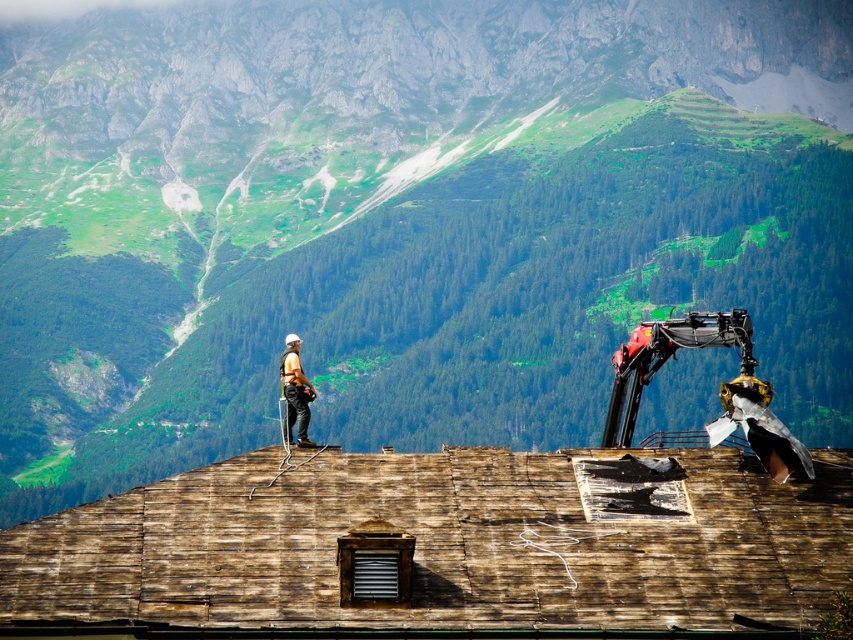
Question: Does weathered wood roof at center have a lesser width compared to white hard hat at center?

Choices:
 (A) no
 (B) yes

Answer: (A)

Question: Can you confirm if weathered wood roof at center is positioned above metallic red robotic arm at upper right?

Choices:
 (A) no
 (B) yes

Answer: (A)

Question: Which point is closer to the camera?

Choices:
 (A) weathered wood roof at center
 (B) metallic red robotic arm at upper right

Answer: (A)

Question: Which of the following is the closest to the observer?

Choices:
 (A) white hard hat at center
 (B) metallic red robotic arm at upper right
 (C) weathered wood roof at center

Answer: (C)

Question: Estimate the real-world distances between objects in this image. Which object is farther from the white hard hat at center?

Choices:
 (A) metallic red robotic arm at upper right
 (B) weathered wood roof at center

Answer: (A)

Question: Is weathered wood roof at center above metallic red robotic arm at upper right?

Choices:
 (A) no
 (B) yes

Answer: (A)